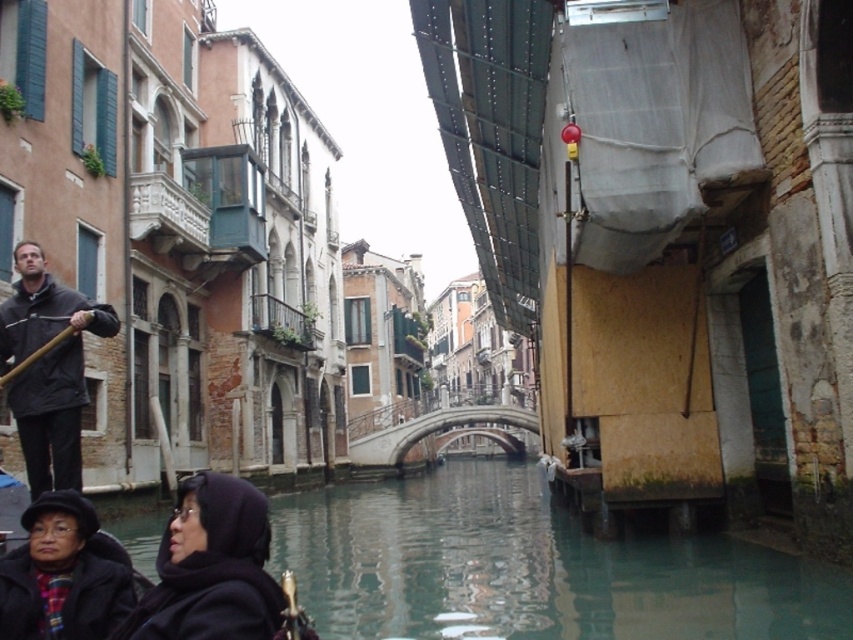
You are a photographer standing on the canal bridge. You see the dark purple fabric headscarf at lower left and the dark gray jacket at left. Which object is wider?

The dark purple fabric headscarf at lower left is wider than the dark gray jacket at left.

You are standing on the gondola and want to place a small item on the dark purple fabric headscarf at lower left. Given that the gondola is moving forward, which direction should you move your hand to reach the headscarf?

The dark purple fabric headscarf at lower left is located at point [212,566], so you should move your hand to the lower left direction to reach it.

You are a tourist on a gondola and want to take a photo of both the dark purple fabric headscarf at lower left and the black woolen hat at lower left. Since you want both items in the frame, should you zoom in or zoom out?

The dark purple fabric headscarf at lower left is in front of the black woolen hat at lower left, so you should zoom out to ensure both items are visible in the photo.